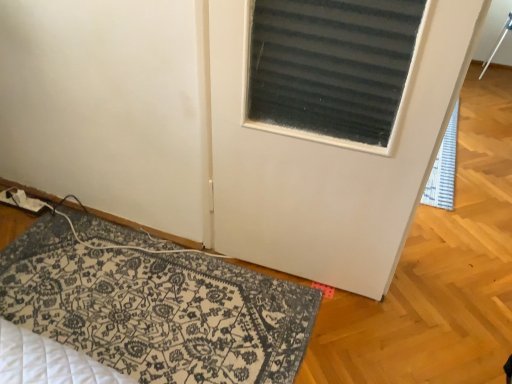
Find the location of a particular element. patterned fabric mat at lower left is located at coordinates (156, 309).

Describe the element at coordinates (156, 309) in the screenshot. I see `patterned fabric mat at lower left` at that location.

Where is `patterned fabric mat at lower left`? The image size is (512, 384). patterned fabric mat at lower left is located at coordinates (156, 309).